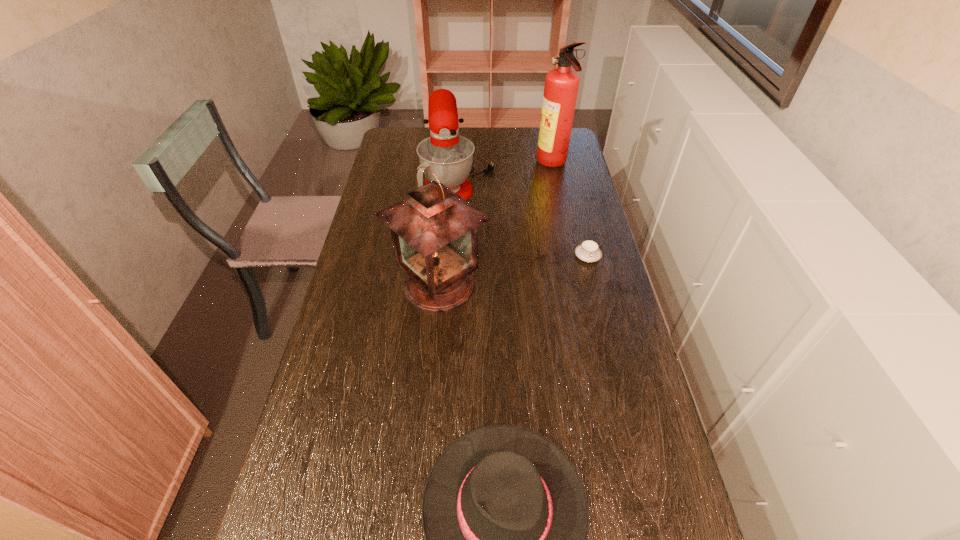
The width and height of the screenshot is (960, 540). Identify the location of fire extinguisher present at the far edge. (561, 86).

I want to click on mixer present at the far edge, so click(449, 156).

Identify the location of object that is positioned at the left edge. (435, 231).

At what (x,y) coordinates should I click in order to perform the action: click on fire extinguisher at the right edge. Please return your answer as a coordinate pair (x, y). The width and height of the screenshot is (960, 540). Looking at the image, I should click on (561, 86).

I want to click on teacup at the right edge, so click(x=588, y=251).

Locate an element on the screen. The width and height of the screenshot is (960, 540). object situated at the far right corner is located at coordinates (561, 86).

Where is `vacant space at the far edge`? The height and width of the screenshot is (540, 960). vacant space at the far edge is located at coordinates (474, 141).

What are the coordinates of `free space at the left edge of the desktop` in the screenshot? It's located at pos(335,440).

In the image, there is a desktop. Where is `vacant space at the right edge`? vacant space at the right edge is located at coordinates (622, 345).

I want to click on free point between the second tallest object and the tallest object, so click(496, 225).